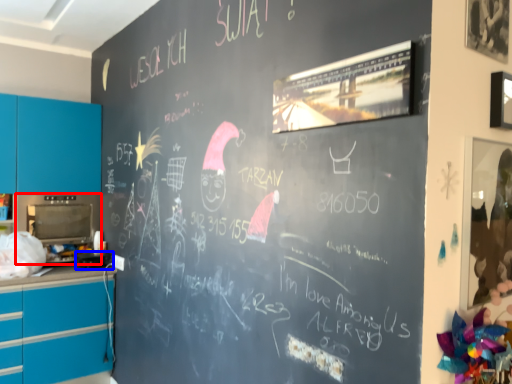
Question: Which object is closer to the camera taking this photo, appliance (highlighted by a red box) or appliance (highlighted by a blue box)?

Choices:
 (A) appliance
 (B) appliance

Answer: (B)